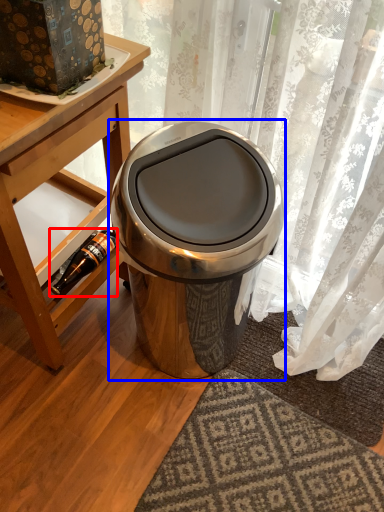
Question: Which object appears farthest to the camera in this image, bottle (highlighted by a red box) or waste container (highlighted by a blue box)?

Choices:
 (A) bottle
 (B) waste container

Answer: (A)